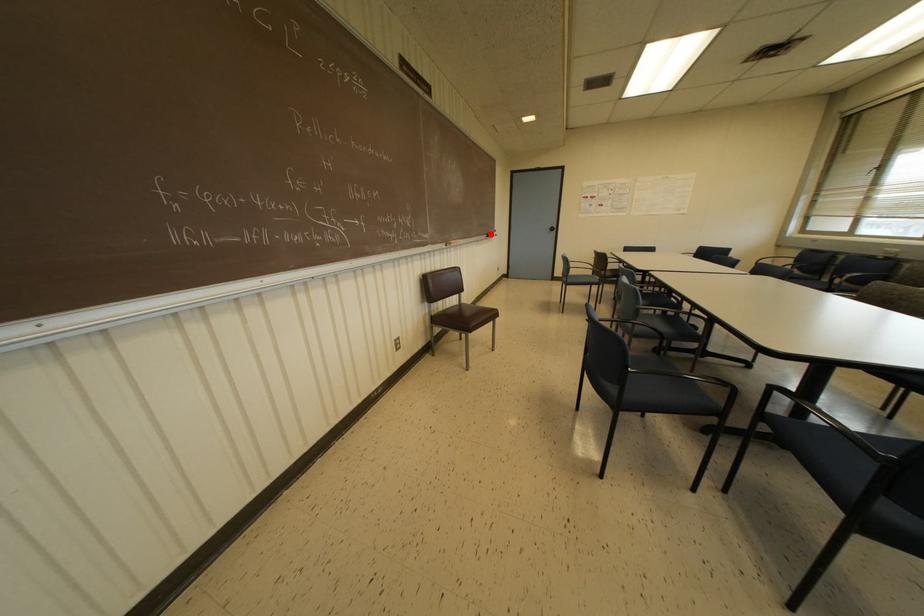
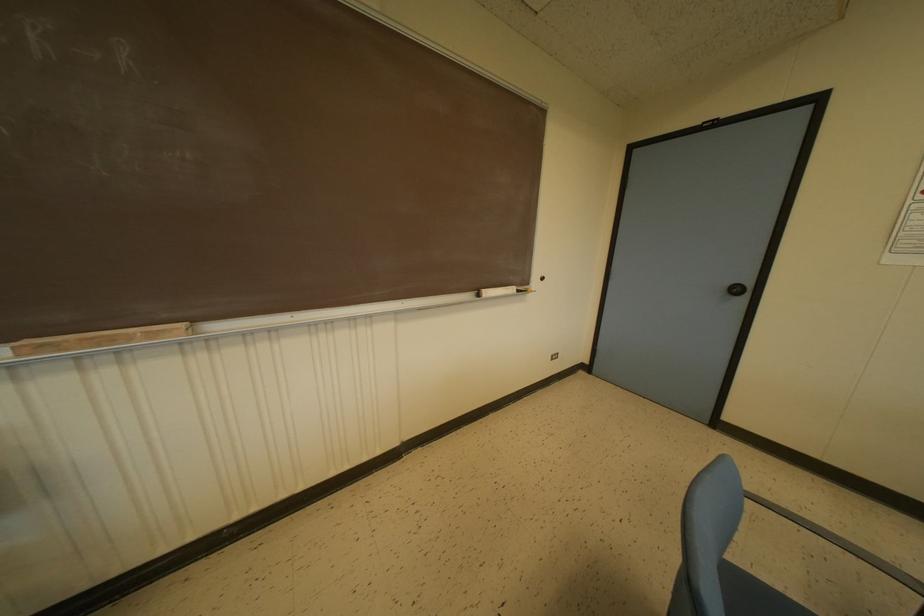
Locate, in the second image, the point that corresponds to the highlighted location in the first image.

(487, 292)